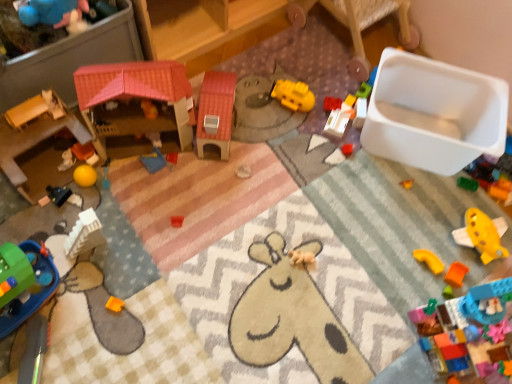
Find the location of `empty space that is in between yellow matte plastic arch at lower right, which appears as the twelfth toy when viewed from the left, and yellow matte plastic toy at center, which is the 8th toy from right to left`. empty space that is in between yellow matte plastic arch at lower right, which appears as the twelfth toy when viewed from the left, and yellow matte plastic toy at center, which is the 8th toy from right to left is located at coordinates (350, 176).